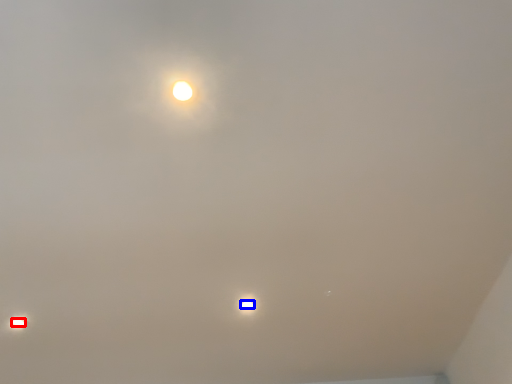
Question: Which object appears closest to the camera in this image, lamp (highlighted by a red box) or lamp (highlighted by a blue box)?

Choices:
 (A) lamp
 (B) lamp

Answer: (B)